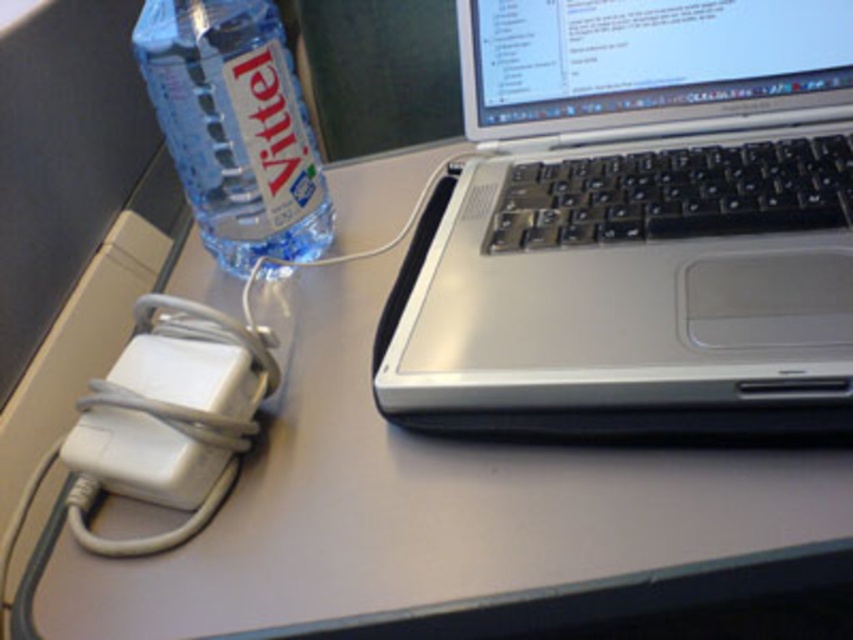
Does point (741, 337) come in front of point (308, 179)?

Yes, it is.

The width and height of the screenshot is (853, 640). I want to click on silver metallic laptop at upper right, so click(640, 225).

Between silver metallic laptop at upper right and white plastic charger at lower left, which one has more height?

Standing taller between the two is silver metallic laptop at upper right.

Consider the image. Which is more to the right, silver metallic laptop at upper right or white plastic charger at lower left?

silver metallic laptop at upper right

Locate an element on the screen. silver metallic laptop at upper right is located at coordinates (640, 225).

Can you confirm if blue plastic bottle at left is shorter than white plastic charger at lower left?

In fact, blue plastic bottle at left may be taller than white plastic charger at lower left.

Based on the photo, can you confirm if blue plastic bottle at left is wider than white plastic charger at lower left?

Yes, blue plastic bottle at left is wider than white plastic charger at lower left.

Locate an element on the screen. blue plastic bottle at left is located at coordinates (235, 128).

Find the location of `blue plastic bottle at left`. blue plastic bottle at left is located at coordinates (235, 128).